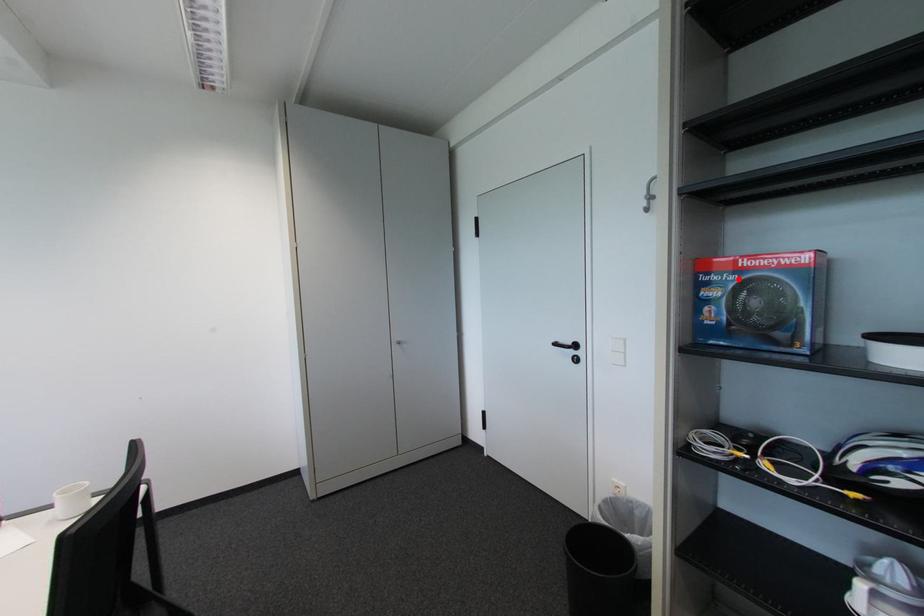
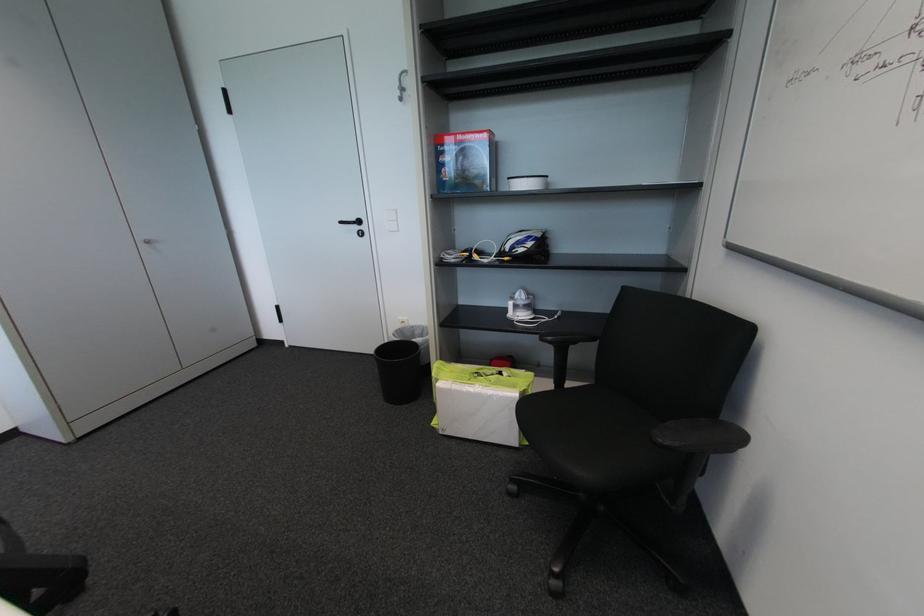
In the second image, find the point that corresponds to the highlighted location in the first image.

(460, 148)